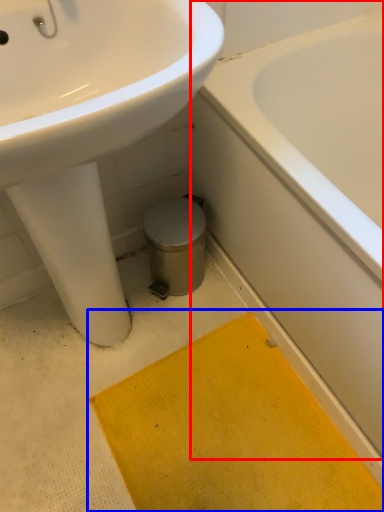
Question: Which of the following is the farthest to the observer, bathtub (highlighted by a red box) or bath mat (highlighted by a blue box)?

Choices:
 (A) bathtub
 (B) bath mat

Answer: (B)